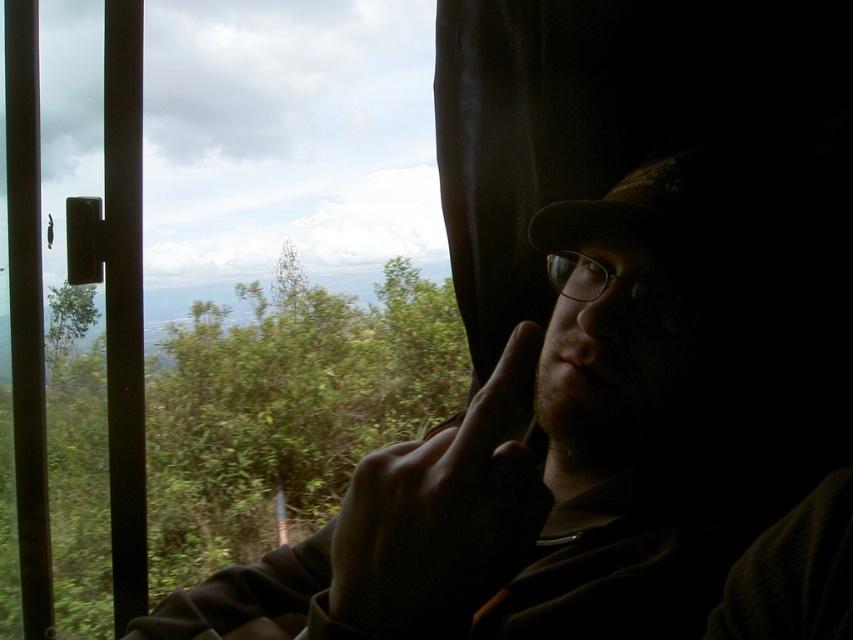
Between point (361, 348) and point (409, 564), which one is positioned in front?

Positioned in front is point (409, 564).

Does point (91, 20) come behind point (467, 584)?

Yes, it is.

Find the location of a particular element. Image resolution: width=853 pixels, height=640 pixels. transparent glass window at upper left is located at coordinates (283, 406).